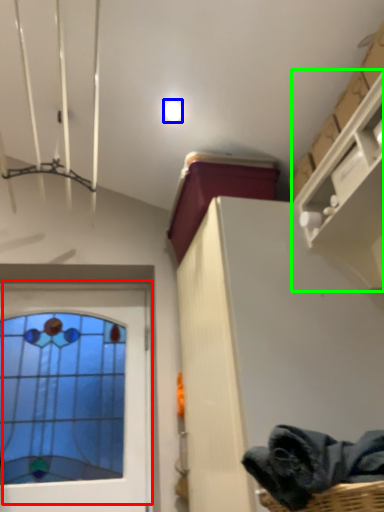
Question: Which object is positioned closest to window (highlighted by a red box)? Select from droplight (highlighted by a blue box) and shelf (highlighted by a green box).

Choices:
 (A) droplight
 (B) shelf

Answer: (B)